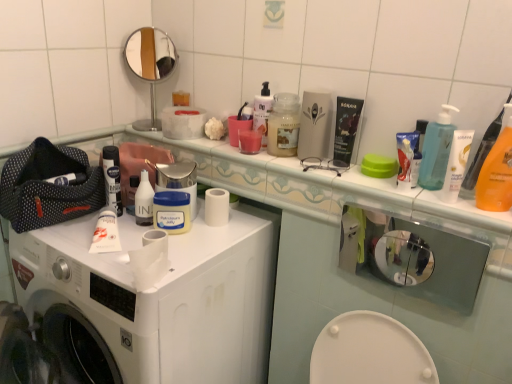
Locate an element on the screen. The image size is (512, 384). white matte jar at center, which is counted as the second mouthwash, starting from the left is located at coordinates (172, 211).

This screenshot has width=512, height=384. Identify the location of translucent plastic pump bottle at upper right. (437, 150).

Identify the location of metallic silver glasses at upper center. Image resolution: width=512 pixels, height=384 pixels. (324, 165).

Measure the distance between point (117, 242) and camera.

1.09 meters.

Identify the location of white matte jar at center, the 3th mouthwash positioned from the right. (172, 211).

Is white plastic container at upper right, positioned as the first product in right-to-left order, oriented towards orange plastic bottle at right?

No, white plastic container at upper right, positioned as the first product in right-to-left order, does not turn towards orange plastic bottle at right.

From the image's perspective, does white plastic container at upper right, which is the second product from back to front, appear lower than orange plastic bottle at right?

Incorrect, from the image's perspective, white plastic container at upper right, which is the second product from back to front, is higher than orange plastic bottle at right.

Considering the relative sizes of white plastic container at upper right, which is the second product from back to front, and orange plastic bottle at right in the image provided, is white plastic container at upper right, which is the second product from back to front, taller than orange plastic bottle at right?

No.

Image resolution: width=512 pixels, height=384 pixels. Find the location of `the 1st product above the orange plastic bottle at right (from the image's perspective)`. the 1st product above the orange plastic bottle at right (from the image's perspective) is located at coordinates (408, 158).

Is white plastic bottle at center, marked as the 2th toiletry in a front-to-back arrangement, positioned with its back to metallic silver glasses at upper center?

No, white plastic bottle at center, marked as the 2th toiletry in a front-to-back arrangement, is not facing away from metallic silver glasses at upper center.

Consider the image. Is white plastic bottle at center, acting as the 1th toiletry starting from the back, situated inside metallic silver glasses at upper center or outside?

white plastic bottle at center, acting as the 1th toiletry starting from the back, is not inside metallic silver glasses at upper center, it's outside.

From a real-world perspective, which object rests below the other?

From a 3D spatial view, white plastic bottle at center, marked as the 2th toiletry in a front-to-back arrangement, is below.

Relative to metallic silver glasses at upper center, is white plastic bottle at center, acting as the 2th toiletry starting from the right, in front or behind?

white plastic bottle at center, acting as the 2th toiletry starting from the right, is positioned farther from the viewer than metallic silver glasses at upper center.

Would you say white plastic container at upper right, the 1th product viewed from the front, is to the left or to the right of white matte jar at center, which is counted as the second mouthwash, starting from the left, in the picture?

Clearly, white plastic container at upper right, the 1th product viewed from the front, is on the right of white matte jar at center, which is counted as the second mouthwash, starting from the left, in the image.

How many degrees apart are the facing directions of white plastic container at upper right, which is the second product from back to front, and white matte jar at center, which is counted as the second mouthwash, starting from the left?

2.26 degrees.

Does white plastic container at upper right, positioned as the first product in right-to-left order, have a smaller size compared to white matte jar at center, the 3th mouthwash positioned from the right?

Indeed, white plastic container at upper right, positioned as the first product in right-to-left order, has a smaller size compared to white matte jar at center, the 3th mouthwash positioned from the right.

Which object is further away from the camera taking this photo, white plastic container at upper right, positioned as the first product in right-to-left order, or white matte jar at center, the 3th mouthwash positioned from the right?

white matte jar at center, the 3th mouthwash positioned from the right, is further away from the camera.

Would you say white matte tube at center is a long distance from black matte tube at upper center, which is the 2th product from right to left?

No.

From a real-world perspective, is white matte tube at center below black matte tube at upper center, the first product from the left?

Yes.

Considering the relative sizes of white matte tube at center and black matte tube at upper center, which is counted as the first product, starting from the back, in the image provided, is white matte tube at center wider than black matte tube at upper center, which is counted as the first product, starting from the back,?

Yes, white matte tube at center is wider than black matte tube at upper center, which is counted as the first product, starting from the back.

Would you say white matte tube at center is to the left or to the right of black matte tube at upper center, the first product from the left, in the picture?

white matte tube at center is to the left of black matte tube at upper center, the first product from the left.

Is white plastic container at upper right, the 1th product viewed from the front, beside white glossy lotion at upper right, acting as the first toiletry starting from the right?

Yes, the surface of white plastic container at upper right, the 1th product viewed from the front, is in contact with white glossy lotion at upper right, acting as the first toiletry starting from the right.

Is white plastic container at upper right, which ranks as the second product in left-to-right order, looking in the opposite direction of white glossy lotion at upper right, acting as the second toiletry starting from the left?

No.

Considering the sizes of white plastic container at upper right, positioned as the first product in right-to-left order, and white glossy lotion at upper right, marked as the 1th toiletry in a front-to-back arrangement, in the image, is white plastic container at upper right, positioned as the first product in right-to-left order, wider or thinner than white glossy lotion at upper right, marked as the 1th toiletry in a front-to-back arrangement,?

Clearly, white plastic container at upper right, positioned as the first product in right-to-left order, has less width compared to white glossy lotion at upper right, marked as the 1th toiletry in a front-to-back arrangement.

Looking at this image, which of these two, white plastic container at upper right, the 1th product viewed from the front, or white glossy lotion at upper right, acting as the second toiletry starting from the back, is bigger?

white glossy lotion at upper right, acting as the second toiletry starting from the back.

From a real-world perspective, is white matte jar at center, which is counted as the second mouthwash, starting from the left, physically below translucent plastic pump bottle at upper right?

Indeed, from a real-world perspective, white matte jar at center, which is counted as the second mouthwash, starting from the left, is positioned beneath translucent plastic pump bottle at upper right.

Measure the distance between white matte jar at center, the 3th mouthwash positioned from the right, and translucent plastic pump bottle at upper right.

white matte jar at center, the 3th mouthwash positioned from the right, is 25.81 inches from translucent plastic pump bottle at upper right.

Between white matte jar at center, the 3th mouthwash positioned from the right, and translucent plastic pump bottle at upper right, which one has less height?

With less height is white matte jar at center, the 3th mouthwash positioned from the right.

How different are the orientations of white matte jar at center, which is counted as the second mouthwash, starting from the left, and translucent plastic pump bottle at upper right in degrees?

The angle between the facing direction of white matte jar at center, which is counted as the second mouthwash, starting from the left, and the facing direction of translucent plastic pump bottle at upper right is 41.7 degrees.

Does white matte tube at center turn towards orange plastic bottle at right?

No, white matte tube at center is not facing towards orange plastic bottle at right.

From the picture: From a real-world perspective, is white matte tube at center below orange plastic bottle at right?

Indeed, from a real-world perspective, white matte tube at center is positioned beneath orange plastic bottle at right.

In the scene shown: Is white matte tube at center positioned far away from orange plastic bottle at right?

They are positioned close to each other.

Which object is closer to the camera taking this photo, white matte tube at center or orange plastic bottle at right?

Positioned in front is orange plastic bottle at right.

The height and width of the screenshot is (384, 512). Identify the location of product that is the 1st one when counting leftward from the orange plastic bottle at right. (408, 158).

Image resolution: width=512 pixels, height=384 pixels. What are the coordinates of `accessory on the right of white plastic bottle at center, acting as the 1th toiletry starting from the back` in the screenshot? It's located at (324, 165).

Which object lies nearer to the anchor point metallic silver glasses at upper center, translucent plastic cup at center, which ranks as the third mouthwash in left-to-right order, or white matte washing machine at center?

translucent plastic cup at center, which ranks as the third mouthwash in left-to-right order.

In the scene shown: Looking at the image, which one is located further to translucent plastic cup at center, which ranks as the third mouthwash in left-to-right order, metallic silver glasses at upper center or translucent plastic jar at center, the first mouthwash from the right?

metallic silver glasses at upper center is positioned further to the anchor translucent plastic cup at center, which ranks as the third mouthwash in left-to-right order.

Estimate the real-world distances between objects in this image. Which object is further from metallic round mirror at upper center, metallic silver glasses at upper center or white glossy lotion at upper right, acting as the second toiletry starting from the left?

The object further to metallic round mirror at upper center is white glossy lotion at upper right, acting as the second toiletry starting from the left.

When comparing their distances from white matte washing machine at center, does white glossy lotion at upper right, marked as the 1th toiletry in a front-to-back arrangement, or white matte jar at center, the 3th mouthwash positioned from the right, seem closer?

Based on the image, white matte jar at center, the 3th mouthwash positioned from the right, appears to be nearer to white matte washing machine at center.

From the image, which object appears to be nearer to translucent plastic jar at center, the first mouthwash from the right, white matte toilet paper at center or white matte jar at center, the 3th mouthwash positioned from the right?

white matte jar at center, the 3th mouthwash positioned from the right, is positioned closer to the anchor translucent plastic jar at center, the first mouthwash from the right.

Consider the image. Looking at the image, which one is located further to translucent plastic jar at center, the first mouthwash from the right, white glossy lotion at upper right, acting as the second toiletry starting from the left, or metallic round mirror at upper center?

metallic round mirror at upper center lies further to translucent plastic jar at center, the first mouthwash from the right, than the other object.

Considering their positions, is translucent plastic cup at center, which ranks as the third mouthwash in left-to-right order, positioned closer to metallic round mirror at upper center than white matte toilet paper at center?

translucent plastic cup at center, which ranks as the third mouthwash in left-to-right order, is positioned closer to the anchor metallic round mirror at upper center.

Considering their positions, is black matte tube at upper center, the first product from the left, positioned closer to white matte toilet paper at center than translucent plastic cup at center, acting as the 2th mouthwash starting from the right?

translucent plastic cup at center, acting as the 2th mouthwash starting from the right, is positioned closer to the anchor white matte toilet paper at center.

You are a GUI agent. You are given a task and a screenshot of the screen. Output one action in this format:
    pyautogui.click(x=<x>, y=<y>)
    Task: Click on the accessory located between metallic round mirror at upper center and white plastic container at upper right, positioned as the first product in right-to-left order, in the left-right direction
    The image size is (512, 384).
    Given the screenshot: What is the action you would take?
    pyautogui.click(x=324, y=165)

Find the location of a particular element. The width and height of the screenshot is (512, 384). turquoise between white matte washing machine at center and white glossy lotion at upper right, acting as the first toiletry starting from the right, in the horizontal direction is located at coordinates (437, 150).

This screenshot has width=512, height=384. Identify the location of toothpaste between white matte washing machine at center and translucent plastic pump bottle at upper right in the horizontal direction. (106, 233).

The height and width of the screenshot is (384, 512). Identify the location of turquoise located between white plastic bottle at center, the 1th toiletry when ordered from left to right, and orange plastic bottle at right in the left-right direction. coord(437,150).